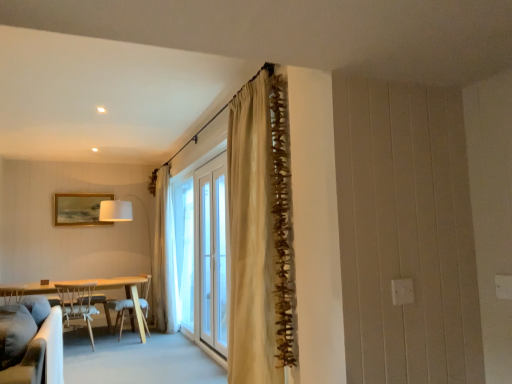
Question: From a real-world perspective, is white wood chair at left, the first chair in the front-to-back sequence, positioned above or below soft gray fabric couch at lower left?

Choices:
 (A) below
 (B) above

Answer: (A)

Question: Considering the positions of point (71, 317) and point (15, 304), is point (71, 317) closer or farther from the camera than point (15, 304)?

Choices:
 (A) farther
 (B) closer

Answer: (A)

Question: Which object is the closest to the white glass screen door at center?

Choices:
 (A) translucent fabric window at center
 (B) soft gray fabric couch at lower left
 (C) white fabric lampshade at left
 (D) beige textured curtain at center, the second curtain viewed from the front
 (E) beige fabric curtain at center, placed as the first curtain when sorted from right to left

Answer: (A)

Question: Estimate the real-world distances between objects in this image. Which object is farther from the beige textured curtain at center, the second curtain viewed from the front?

Choices:
 (A) light wood table at left
 (B) white glass screen door at center
 (C) white fabric lampshade at left
 (D) soft gray fabric couch at lower left
 (E) beige fabric curtain at center, placed as the first curtain when sorted from right to left

Answer: (E)